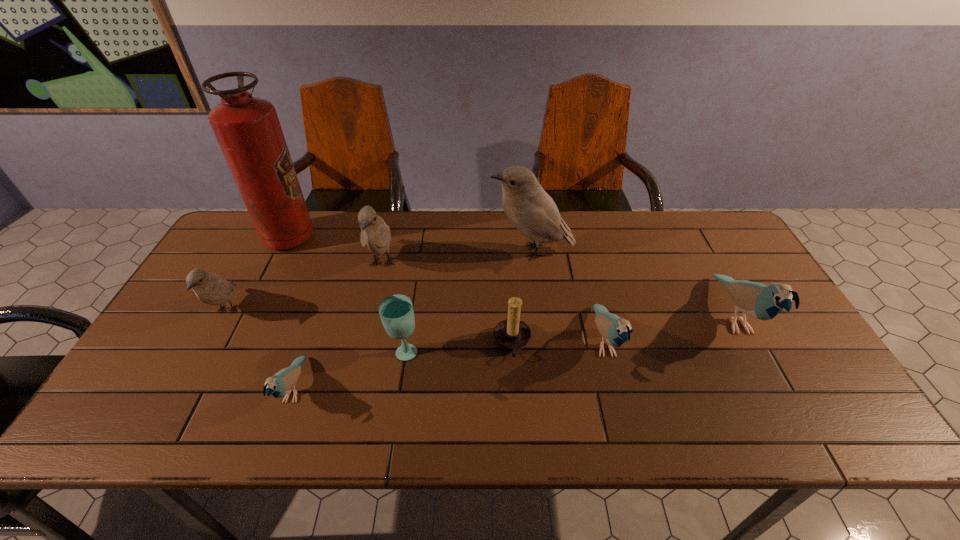
The width and height of the screenshot is (960, 540). What are the coordinates of `bird that is at the left edge` in the screenshot? It's located at (210, 288).

Where is `object that is at the right edge`? The image size is (960, 540). object that is at the right edge is located at coordinates (756, 300).

What are the coordinates of `object located in the far left corner section of the desktop` in the screenshot? It's located at (248, 131).

What are the coordinates of `free space at the far edge of the desktop` in the screenshot? It's located at (657, 238).

In the image, there is a desktop. Where is `blank space at the near edge`? blank space at the near edge is located at coordinates (611, 428).

The image size is (960, 540). What are the coordinates of `vacant space at the left edge` in the screenshot? It's located at (203, 340).

This screenshot has height=540, width=960. Find the location of `free space at the right edge of the desktop`. free space at the right edge of the desktop is located at coordinates (712, 264).

Locate an element on the screen. This screenshot has height=540, width=960. vacant space at the far right corner of the desktop is located at coordinates pos(708,228).

Find the location of a particular element. vacant area that lies between the second blue bird from right to left and the smallest blue bird is located at coordinates (449, 366).

Where is `unoccupied area between the second white bird from right to left and the biggest white bird`? This screenshot has width=960, height=540. unoccupied area between the second white bird from right to left and the biggest white bird is located at coordinates (457, 258).